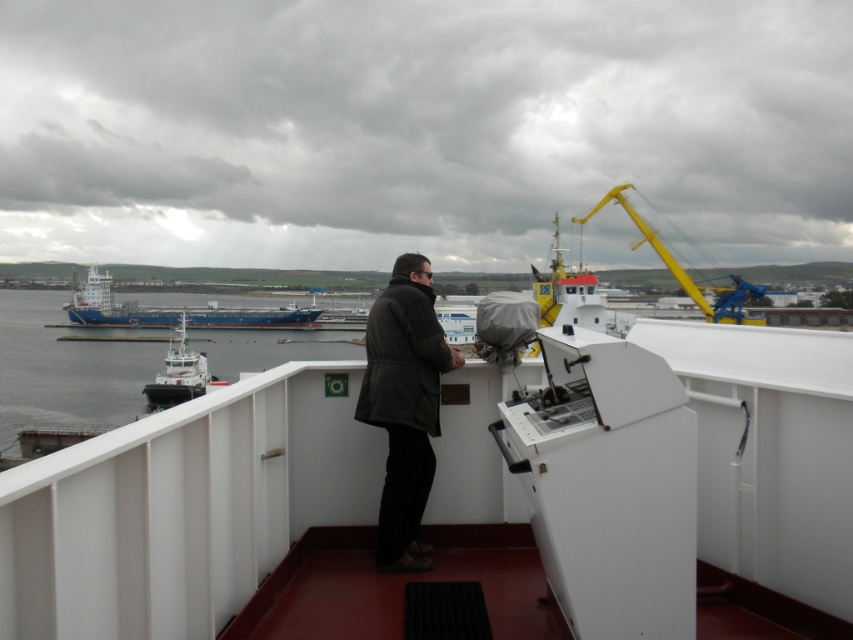
Question: Which of the following is the closest to the observer?

Choices:
 (A) (555, 237)
 (B) (737, 276)

Answer: (A)

Question: Is dark gray jacket at center closer to the viewer compared to white glossy boat at center?

Choices:
 (A) yes
 (B) no

Answer: (A)

Question: Which of the following is the farthest from the observer?

Choices:
 (A) dark gray jacket at center
 (B) blue matte cargo ship at left
 (C) yellow metallic crane at upper center

Answer: (B)

Question: Can you confirm if white glossy boat at center is positioned to the left of white glossy tugboat at left?

Choices:
 (A) yes
 (B) no

Answer: (B)

Question: Which of the following is the closest to the observer?

Choices:
 (A) (149, 408)
 (B) (596, 205)
 (C) (560, 305)

Answer: (A)

Question: Does dark gray jacket at center have a larger size compared to white glossy boat at center?

Choices:
 (A) yes
 (B) no

Answer: (B)